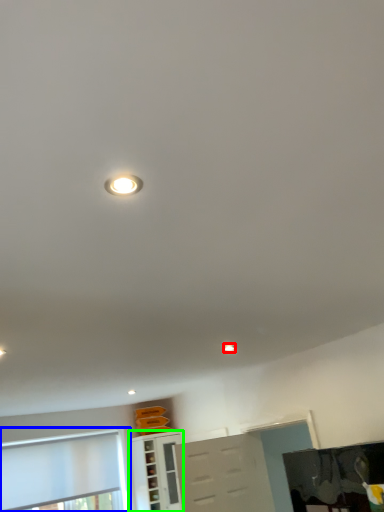
Question: Which object is the farthest from droplight (highlighted by a red box)? Choose among these: window (highlighted by a blue box) or cabinetry (highlighted by a green box).

Choices:
 (A) window
 (B) cabinetry

Answer: (A)